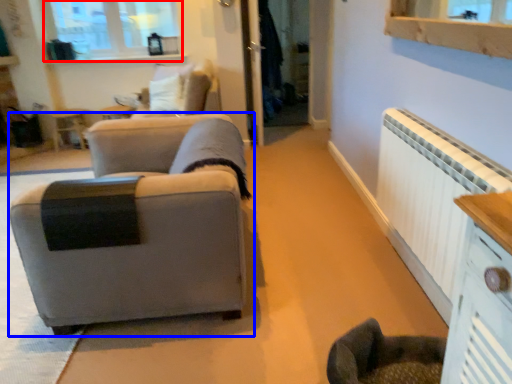
Question: Which of the following is the farthest to the observer, window (highlighted by a red box) or studio couch (highlighted by a blue box)?

Choices:
 (A) window
 (B) studio couch

Answer: (A)